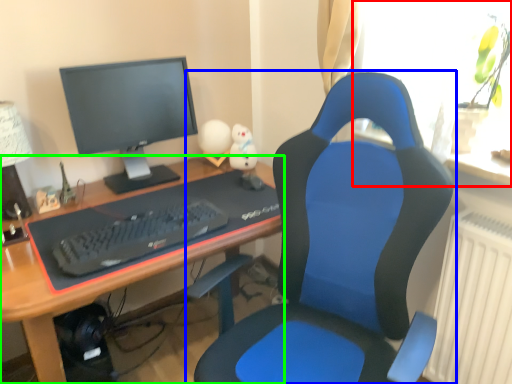
Question: Which is nearer to the window (highlighted by a red box)? chair (highlighted by a blue box) or desk (highlighted by a green box).

Choices:
 (A) chair
 (B) desk

Answer: (A)